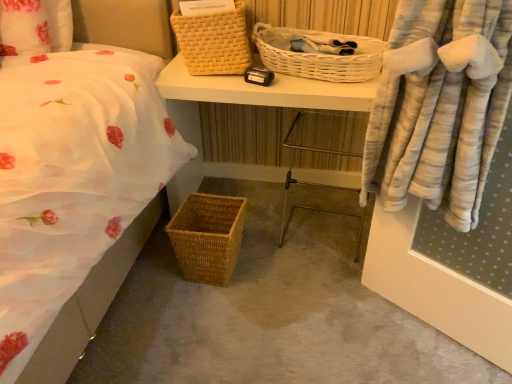
Question: In terms of size, does woven brown picnic basket at lower left, which ranks as the third picnic basket in top-to-bottom order, appear bigger or smaller than metal frame chair at center?

Choices:
 (A) big
 (B) small

Answer: (B)

Question: Is woven brown picnic basket at lower left, which ranks as the third picnic basket in top-to-bottom order, in front of or behind metal frame chair at center in the image?

Choices:
 (A) behind
 (B) front

Answer: (B)

Question: Estimate the real-world distances between objects in this image. Which object is farther from the woven wood desk at center?

Choices:
 (A) yellow woven picnic basket at upper center, arranged as the first picnic basket when viewed from the top
 (B) white wicker picnic basket at upper center, the 2th picnic basket ordered from the bottom
 (C) metal frame chair at center
 (D) woven brown picnic basket at lower left, which ranks as the third picnic basket in top-to-bottom order

Answer: (D)

Question: Which of these objects is positioned farthest from the white wicker picnic basket at upper center, the 2th picnic basket ordered from the bottom?

Choices:
 (A) woven wood desk at center
 (B) metal frame chair at center
 (C) woven brown picnic basket at lower left, which ranks as the third picnic basket in top-to-bottom order
 (D) yellow woven picnic basket at upper center, the 3th picnic basket ordered from the bottom

Answer: (C)